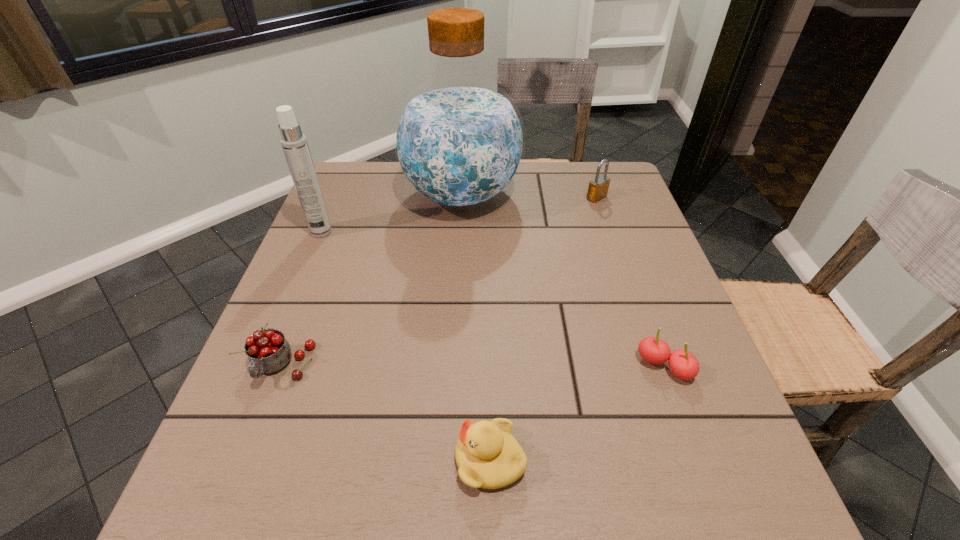
The image size is (960, 540). What are the coordinates of `object that is the third closest one to the fifth shortest object` in the screenshot? It's located at (488, 456).

This screenshot has width=960, height=540. Find the location of `vacant point that satisfies the following two spatial constraints: 1. on the front side of the right cherry; 2. on the right side of the padlock`. vacant point that satisfies the following two spatial constraints: 1. on the front side of the right cherry; 2. on the right side of the padlock is located at coordinates (654, 367).